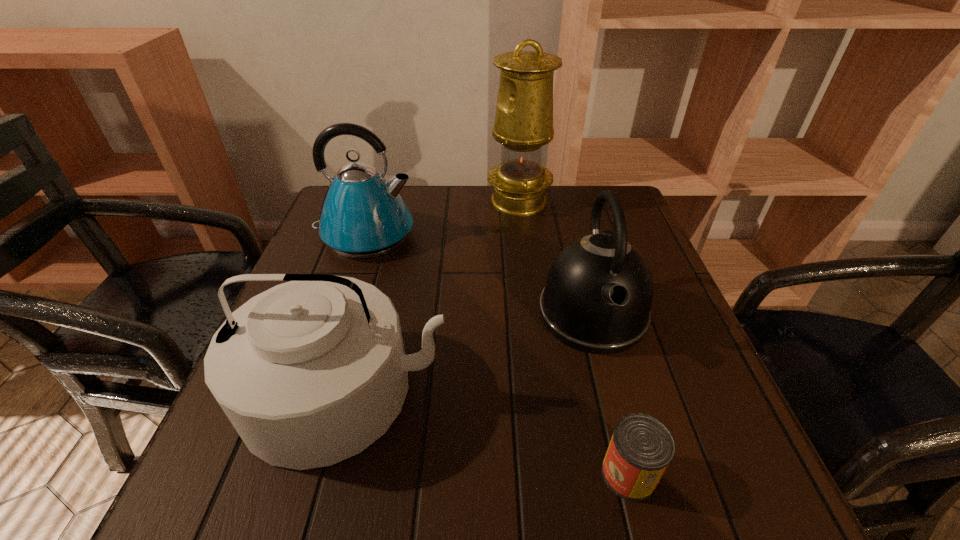
Where is `free space between the rightmost kettle and the shortest object`? The width and height of the screenshot is (960, 540). free space between the rightmost kettle and the shortest object is located at coordinates (611, 394).

Locate which object ranks in proximity to the can. Please provide its 2D coordinates. Your answer should be formatted as a tuple, i.e. [(x, y)], where the tuple contains the x and y coordinates of a point satisfying the conditions above.

[(599, 290)]

Locate an element on the screen. object that is the second closest one to the oil lamp is located at coordinates (599, 290).

At what (x,y) coordinates should I click in order to perform the action: click on kettle that stands as the second closest to the oil lamp. Please return your answer as a coordinate pair (x, y). The image size is (960, 540). Looking at the image, I should click on (599, 290).

Image resolution: width=960 pixels, height=540 pixels. Find the location of `the second closest kettle relative to the oil lamp`. the second closest kettle relative to the oil lamp is located at coordinates (599, 290).

Where is `free location that satisfies the following two spatial constraints: 1. at the spout of the can; 2. on the right side of the farthest kettle`? The width and height of the screenshot is (960, 540). free location that satisfies the following two spatial constraints: 1. at the spout of the can; 2. on the right side of the farthest kettle is located at coordinates (285, 474).

This screenshot has width=960, height=540. Find the location of `free space that satisfies the following two spatial constraints: 1. at the spout of the farthest kettle; 2. on the right side of the can`. free space that satisfies the following two spatial constraints: 1. at the spout of the farthest kettle; 2. on the right side of the can is located at coordinates (285, 474).